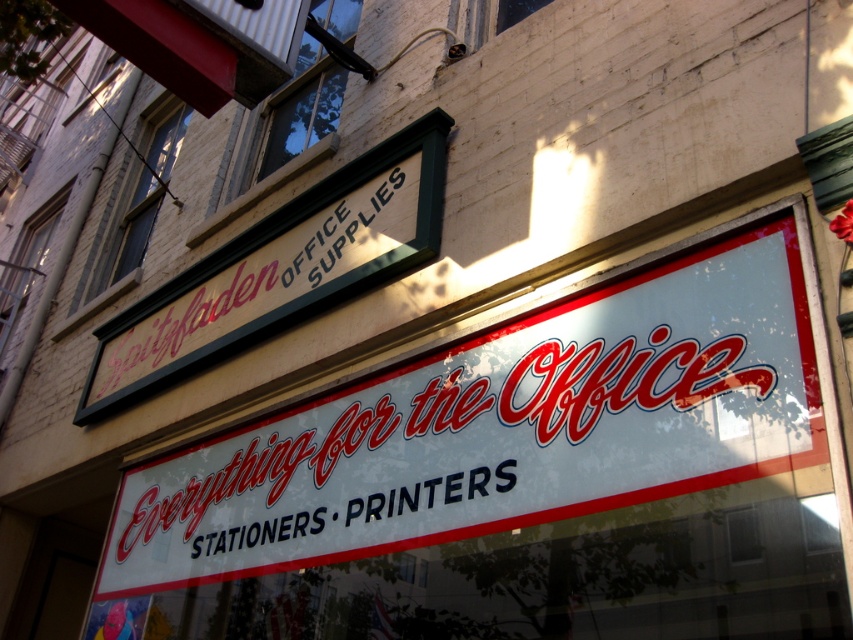
Question: Does white plastic sign at center have a greater width compared to matte green signboard at upper left?

Choices:
 (A) yes
 (B) no

Answer: (A)

Question: Which object is the farthest from the matte green signboard at upper left?

Choices:
 (A) white matte signboard at center
 (B) white plastic sign at center

Answer: (A)

Question: Which point is farther to the camera?

Choices:
 (A) (296, 504)
 (B) (259, 538)

Answer: (B)

Question: Is the position of white plastic sign at center more distant than that of matte green signboard at upper left?

Choices:
 (A) no
 (B) yes

Answer: (A)

Question: Is white plastic sign at center to the right of white matte signboard at center from the viewer's perspective?

Choices:
 (A) no
 (B) yes

Answer: (B)

Question: Which point appears farthest from the camera in this image?

Choices:
 (A) (309, 513)
 (B) (299, 248)
 (C) (589, 499)

Answer: (B)